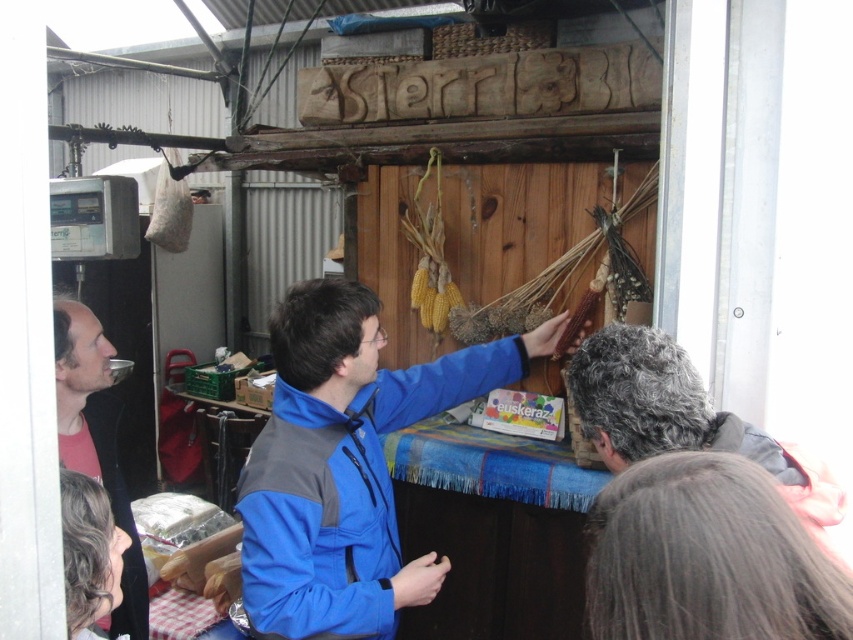
Question: Estimate the real-world distances between objects in this image. Which object is farther from the matte black jacket at left?

Choices:
 (A) blue fleece jacket at center
 (B) gray hair at upper center

Answer: (B)

Question: Considering the real-world distances, which object is closest to the blue fleece jacket at center?

Choices:
 (A) matte black jacket at left
 (B) gray hair at upper center

Answer: (A)

Question: Is blue fleece jacket at center positioned at the back of gray hair at upper center?

Choices:
 (A) no
 (B) yes

Answer: (B)

Question: Is blue fleece jacket at center thinner than gray hair at upper center?

Choices:
 (A) yes
 (B) no

Answer: (B)

Question: Estimate the real-world distances between objects in this image. Which object is closer to the matte black jacket at left?

Choices:
 (A) gray hair at upper center
 (B) blue fleece jacket at center

Answer: (B)

Question: In this image, where is gray hair at upper center located relative to matte black jacket at left?

Choices:
 (A) left
 (B) right

Answer: (B)